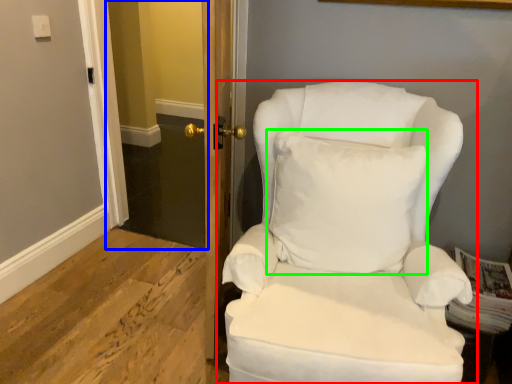
Question: Which is farther away from chair (highlighted by a red box)? glass door (highlighted by a blue box) or pillow (highlighted by a green box)?

Choices:
 (A) glass door
 (B) pillow

Answer: (A)